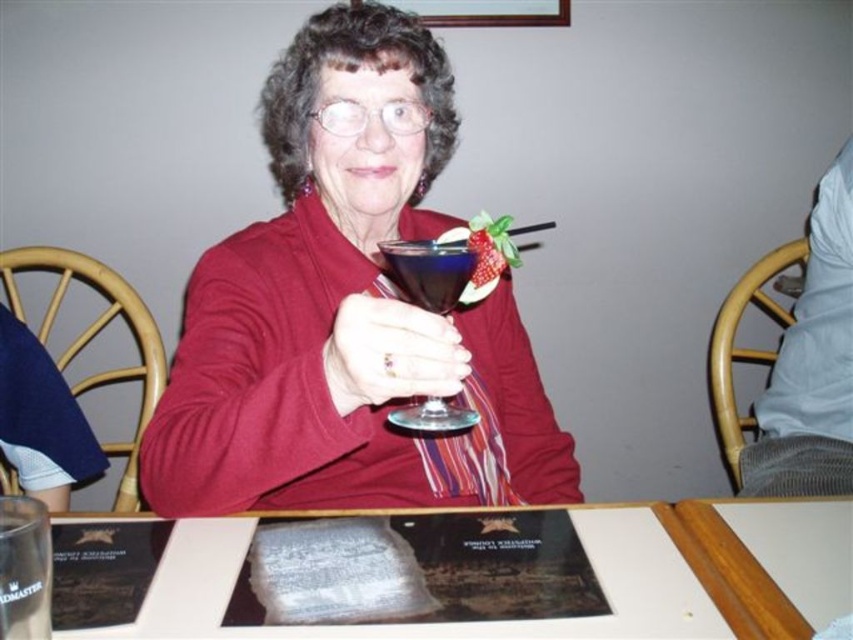
Question: Which of the following is the closest to the observer?

Choices:
 (A) (408, 344)
 (B) (746, 516)
 (C) (434, 275)
 (D) (308, 532)

Answer: (A)

Question: Which point appears farthest from the camera in this image?

Choices:
 (A) (805, 502)
 (B) (399, 410)
 (C) (308, 32)
 (D) (194, 522)

Answer: (C)

Question: Which object is farther from the camera taking this photo?

Choices:
 (A) matte glass at center
 (B) white textured table at center
 (C) transparent glass at center

Answer: (C)

Question: Can you confirm if matte glass at center is positioned to the left of transparent glass at center?

Choices:
 (A) yes
 (B) no

Answer: (B)

Question: Is white textured table at center wider than transparent glass at center?

Choices:
 (A) yes
 (B) no

Answer: (A)

Question: Does matte glass at center have a lesser width compared to white textured table at center?

Choices:
 (A) yes
 (B) no

Answer: (A)